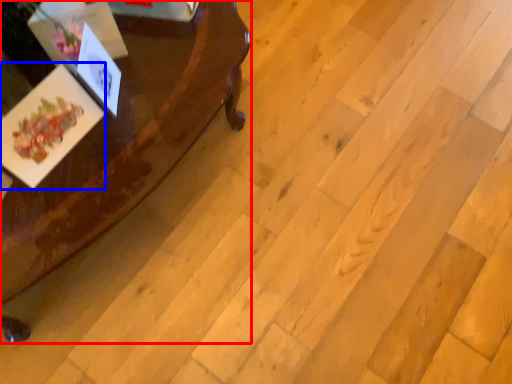
Question: Which point is further to the camera, table (highlighted by a red box) or postcard (highlighted by a blue box)?

Choices:
 (A) table
 (B) postcard

Answer: (B)